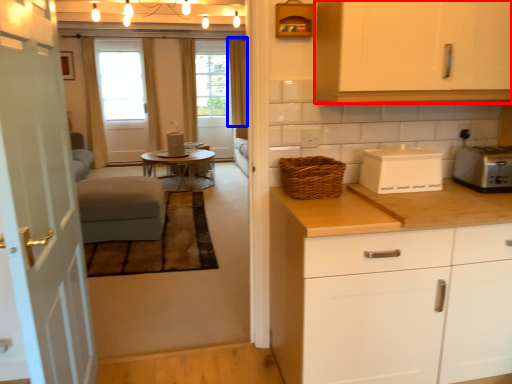
Question: Which point is further to the camera, cabinetry (highlighted by a red box) or curtain (highlighted by a blue box)?

Choices:
 (A) cabinetry
 (B) curtain

Answer: (B)